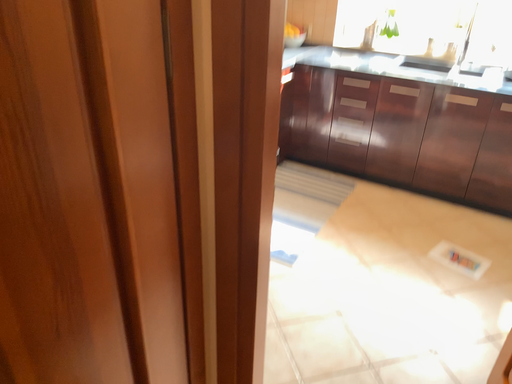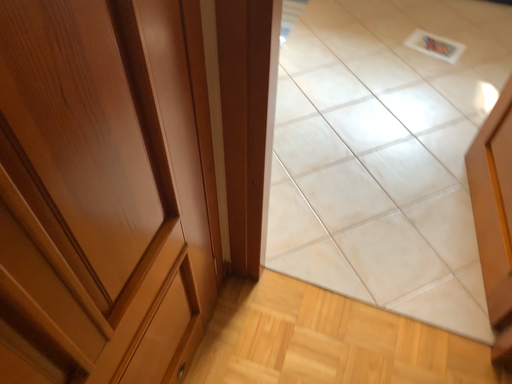
Question: Which way did the camera rotate in the video?

Choices:
 (A) rotated right
 (B) rotated left

Answer: (A)